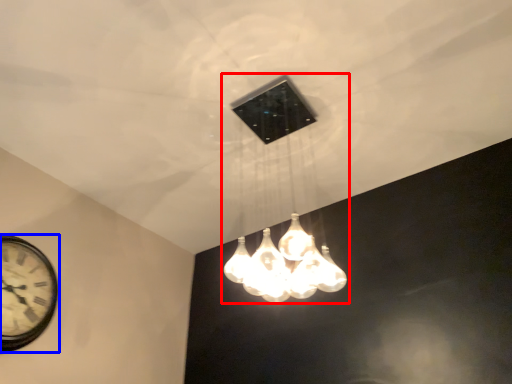
Question: Which point is further to the camera, lamp (highlighted by a red box) or wall clock (highlighted by a blue box)?

Choices:
 (A) lamp
 (B) wall clock

Answer: (B)